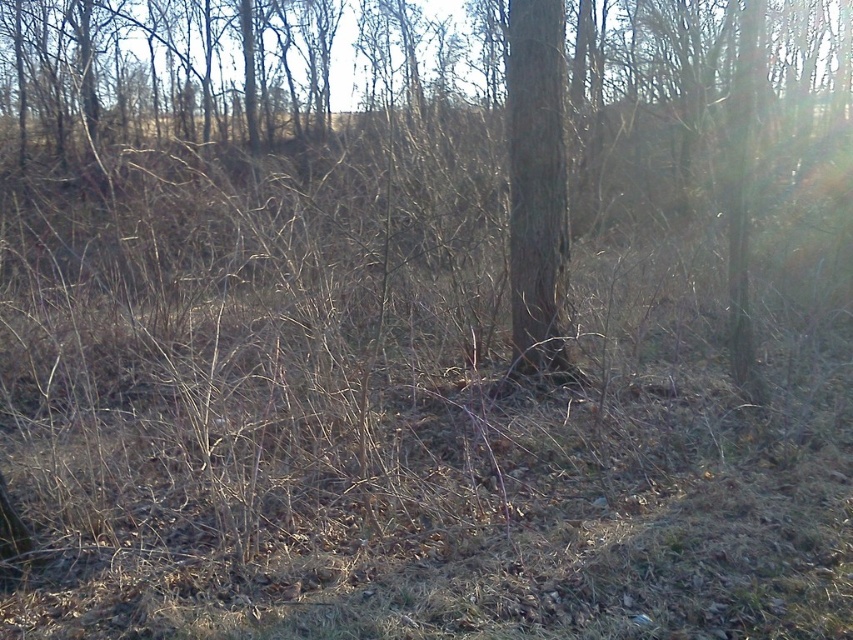
You are an artist sketching the scene and want to draw the brown rough tree at center and the brown rough bark tree at center. Which one should you draw first if you follow the rule of drawing objects from bottom to top?

You should draw the brown rough bark tree at center first because it is located below the brown rough tree at center.

You are an arborist examining two trees in the scene. You notice both the brown rough tree at center and the brown rough bark tree at center. Which of these two trees is larger in size?

The brown rough tree at center is bigger than the brown rough bark tree at center.

You are a photographer adjusting your camera settings to focus on two points in the scene. The first point is at coordinates point (610, 124) and the second is at point (509, 161). Which point should you focus on first if you want to ensure both are in sharp focus?

You should focus on point (509, 161) first because it is closer to the camera than point (610, 124). By focusing on the closer point, the depth of field may extend to include the farther point as well.